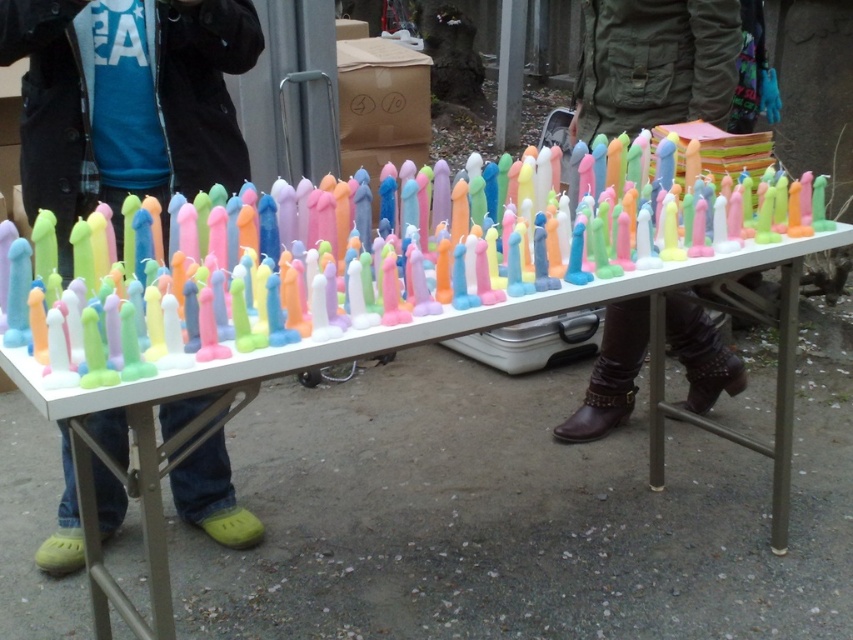
Is the position of matte plastic toy at left less distant than that of pastel wax candles at center?

No, matte plastic toy at left is further to the viewer.

Is matte plastic toy at left shorter than pastel wax candles at center?

A: Incorrect, matte plastic toy at left's height does not fall short of pastel wax candles at center's.

Who is more forward, (100, 132) or (183, 246)?

Point (183, 246) is more forward.

Find the location of a particular element. The height and width of the screenshot is (640, 853). matte plastic toy at left is located at coordinates (126, 100).

Which of these two, white plastic table at center or brown leather boots at lower center, stands shorter?

Standing shorter between the two is brown leather boots at lower center.

Which is above, white plastic table at center or brown leather boots at lower center?

brown leather boots at lower center

Does point (711, 522) lie in front of point (715, 51)?

That is True.

The image size is (853, 640). What are the coordinates of `white plastic table at center` in the screenshot? It's located at (442, 467).

Between white plastic table at center and matte plastic toy at left, which one is positioned lower?

white plastic table at center

Does white plastic table at center have a greater width compared to matte plastic toy at left?

Correct, the width of white plastic table at center exceeds that of matte plastic toy at left.

Who is more forward, (526, 420) or (68, 189)?

Point (68, 189)

This screenshot has height=640, width=853. I want to click on white plastic table at center, so click(x=442, y=467).